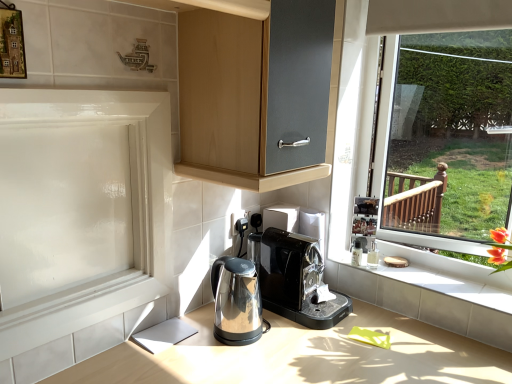
Question: Would you say stainless steel kettle at lower center, placed as the first home appliance when sorted from left to right, is outside white glossy screen door at left?

Choices:
 (A) no
 (B) yes

Answer: (B)

Question: Is stainless steel kettle at lower center, placed as the first home appliance when sorted from left to right, oriented away from white glossy screen door at left?

Choices:
 (A) yes
 (B) no

Answer: (B)

Question: Can you confirm if stainless steel kettle at lower center, the second home appliance from the right, is positioned to the left of white glossy screen door at left?

Choices:
 (A) yes
 (B) no

Answer: (B)

Question: Would you say white glossy screen door at left is part of stainless steel kettle at lower center, placed as the first home appliance when sorted from left to right,'s contents?

Choices:
 (A) yes
 (B) no

Answer: (B)

Question: Is stainless steel kettle at lower center, the second home appliance from the right, thinner than white glossy screen door at left?

Choices:
 (A) no
 (B) yes

Answer: (A)

Question: From the image's perspective, is white tile at lower right above or below white glossy screen door at left?

Choices:
 (A) below
 (B) above

Answer: (A)

Question: In terms of size, does white tile at lower right appear bigger or smaller than white glossy screen door at left?

Choices:
 (A) big
 (B) small

Answer: (B)

Question: Considering the positions of white tile at lower right and white glossy screen door at left in the image, is white tile at lower right wider or thinner than white glossy screen door at left?

Choices:
 (A) thin
 (B) wide

Answer: (B)

Question: In the image, is white tile at lower right positioned in front of or behind white glossy screen door at left?

Choices:
 (A) behind
 (B) front

Answer: (A)

Question: Considering the positions of satin metallic countertop at center and white glossy screen door at left in the image, is satin metallic countertop at center bigger or smaller than white glossy screen door at left?

Choices:
 (A) small
 (B) big

Answer: (B)

Question: From a real-world perspective, is satin metallic countertop at center physically located above or below white glossy screen door at left?

Choices:
 (A) above
 (B) below

Answer: (B)

Question: Is satin metallic countertop at center taller or shorter than white glossy screen door at left?

Choices:
 (A) tall
 (B) short

Answer: (B)

Question: Considering the positions of point (368, 304) and point (31, 215), is point (368, 304) closer or farther from the camera than point (31, 215)?

Choices:
 (A) closer
 (B) farther

Answer: (B)

Question: Is point (395, 251) positioned closer to the camera than point (209, 324)?

Choices:
 (A) farther
 (B) closer

Answer: (A)

Question: Is white tile at lower right wider or thinner than satin metallic countertop at center?

Choices:
 (A) thin
 (B) wide

Answer: (A)